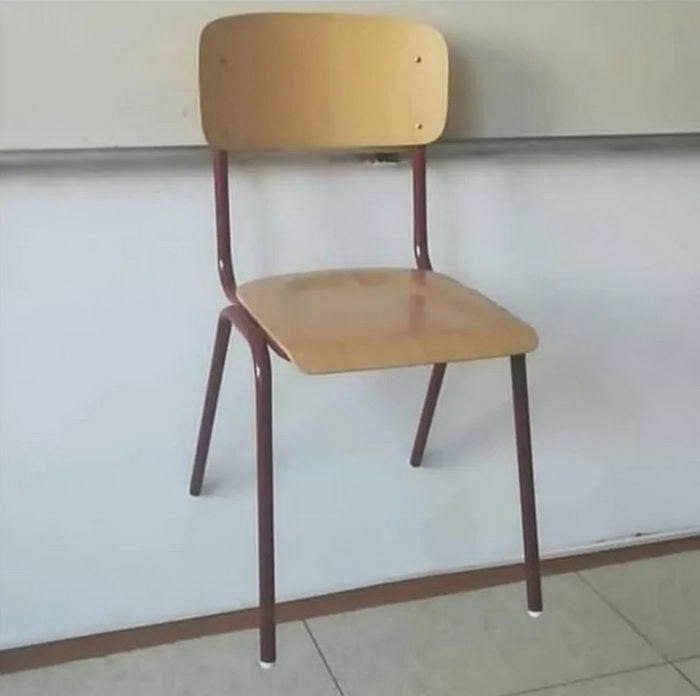
The height and width of the screenshot is (696, 700). Find the location of `tiles`. tiles is located at coordinates (682, 615), (687, 664), (648, 683), (421, 649), (195, 683).